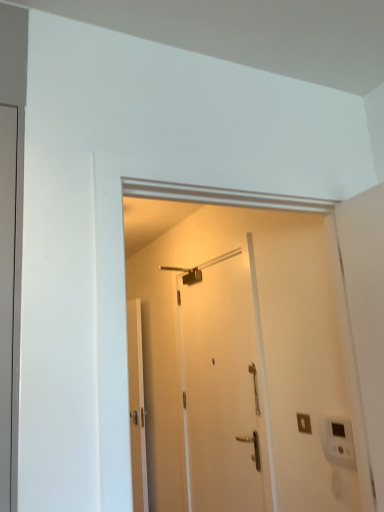
Question: Can you confirm if white matte door at center, the third door viewed from the left, is thinner than matte gray door at left, arranged as the 1th door when viewed from the left?

Choices:
 (A) no
 (B) yes

Answer: (B)

Question: Is white matte door at center, which appears as the first door when viewed from the right, wider than matte gray door at left, arranged as the 1th door when viewed from the left?

Choices:
 (A) no
 (B) yes

Answer: (A)

Question: Is there a large distance between white matte door at center, which is the 2th door from back to front, and matte gray door at left, arranged as the 1th door when viewed from the left?

Choices:
 (A) yes
 (B) no

Answer: (A)

Question: Is white matte door at center, the third door viewed from the left, positioned behind matte gray door at left, the third door when ordered from back to front?

Choices:
 (A) yes
 (B) no

Answer: (A)

Question: Is white matte door at center, the third door viewed from the left, oriented towards matte gray door at left, the third door viewed from the right?

Choices:
 (A) yes
 (B) no

Answer: (B)

Question: Does white matte door at center, the third door viewed from the left, appear on the left side of matte gray door at left, the third door viewed from the right?

Choices:
 (A) no
 (B) yes

Answer: (A)

Question: Considering the relative sizes of white glossy door at center, arranged as the 3th door when viewed from the front, and matte gray door at left, the third door when ordered from back to front, in the image provided, is white glossy door at center, arranged as the 3th door when viewed from the front, bigger than matte gray door at left, the third door when ordered from back to front,?

Choices:
 (A) no
 (B) yes

Answer: (A)

Question: From the image's perspective, is white glossy door at center, arranged as the 3th door when viewed from the front, under matte gray door at left, arranged as the 1th door when viewed from the left?

Choices:
 (A) no
 (B) yes

Answer: (B)

Question: Is white glossy door at center, the first door positioned from the back, smaller than matte gray door at left, the third door when ordered from back to front?

Choices:
 (A) no
 (B) yes

Answer: (B)

Question: Is white glossy door at center, the first door positioned from the back, oriented towards matte gray door at left, arranged as the 1th door when viewed from the left?

Choices:
 (A) yes
 (B) no

Answer: (B)

Question: Is white glossy door at center, arranged as the 3th door when viewed from the front, closer to camera compared to matte gray door at left, the third door viewed from the right?

Choices:
 (A) no
 (B) yes

Answer: (A)

Question: Does white glossy door at center, arranged as the second door when viewed from the left, have a greater height compared to matte gray door at left, the third door viewed from the right?

Choices:
 (A) yes
 (B) no

Answer: (A)

Question: Can you confirm if white matte door at center, the third door viewed from the left, is taller than white glossy door at center, arranged as the second door when viewed from the left?

Choices:
 (A) yes
 (B) no

Answer: (B)